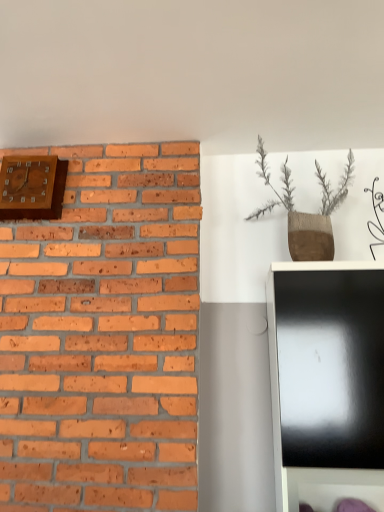
What do you see at coordinates (32, 187) in the screenshot?
I see `wooden clock at upper left` at bounding box center [32, 187].

At what (x,y) coordinates should I click in order to perform the action: click on wooden clock at upper left. Please return your answer as a coordinate pair (x, y). Image resolution: width=384 pixels, height=512 pixels. Looking at the image, I should click on (32, 187).

Describe the element at coordinates (306, 213) in the screenshot. I see `textured brown vase at upper right` at that location.

Locate an element on the screen. The height and width of the screenshot is (512, 384). textured brown vase at upper right is located at coordinates (306, 213).

I want to click on wooden clock at upper left, so click(x=32, y=187).

Considering the positions of objects wooden clock at upper left and textured brown vase at upper right in the image provided, who is more to the left, wooden clock at upper left or textured brown vase at upper right?

From the viewer's perspective, wooden clock at upper left appears more on the left side.

From the picture: Does wooden clock at upper left come in front of textured brown vase at upper right?

No, wooden clock at upper left is further to the viewer.

Considering the positions of point (49, 217) and point (312, 240), is point (49, 217) closer or farther from the camera than point (312, 240)?

Point (49, 217).

From the image's perspective, between wooden clock at upper left and textured brown vase at upper right, who is located below?

textured brown vase at upper right.

From a real-world perspective, who is located lower, wooden clock at upper left or textured brown vase at upper right?

In real-world perspective, textured brown vase at upper right is lower.

In terms of width, does wooden clock at upper left look wider or thinner when compared to textured brown vase at upper right?

wooden clock at upper left is thinner than textured brown vase at upper right.

In terms of height, does wooden clock at upper left look taller or shorter compared to textured brown vase at upper right?

Considering their sizes, wooden clock at upper left has less height than textured brown vase at upper right.

Based on their sizes in the image, would you say wooden clock at upper left is bigger or smaller than textured brown vase at upper right?

Clearly, wooden clock at upper left is smaller in size than textured brown vase at upper right.

Would you say wooden clock at upper left is outside textured brown vase at upper right?

Yes, wooden clock at upper left is located beyond the bounds of textured brown vase at upper right.

Are wooden clock at upper left and textured brown vase at upper right far apart?

wooden clock at upper left is far away from textured brown vase at upper right.

Is wooden clock at upper left oriented towards textured brown vase at upper right?

No, wooden clock at upper left is not facing towards textured brown vase at upper right.

Find the location of `houseplant in front of the wooden clock at upper left`. houseplant in front of the wooden clock at upper left is located at coordinates (306, 213).

Considering the positions of objects textured brown vase at upper right and wooden clock at upper left in the image provided, who is more to the left, textured brown vase at upper right or wooden clock at upper left?

wooden clock at upper left.

Does textured brown vase at upper right lie in front of wooden clock at upper left?

That is True.

Does point (285, 159) come behind point (48, 176)?

Yes, it is.

In the scene shown: From the image's perspective, is textured brown vase at upper right located above wooden clock at upper left?

No.

From a real-world perspective, which is physically below, textured brown vase at upper right or wooden clock at upper left?

From a 3D spatial view, textured brown vase at upper right is below.

Which object is wider, textured brown vase at upper right or wooden clock at upper left?

Wider between the two is textured brown vase at upper right.

Can you confirm if textured brown vase at upper right is taller than wooden clock at upper left?

Indeed, textured brown vase at upper right has a greater height compared to wooden clock at upper left.

In terms of size, does textured brown vase at upper right appear bigger or smaller than wooden clock at upper left?

textured brown vase at upper right is bigger than wooden clock at upper left.

In the scene shown: Which is correct: textured brown vase at upper right is inside wooden clock at upper left, or outside of it?

textured brown vase at upper right lies outside wooden clock at upper left.

From the picture: Are textured brown vase at upper right and wooden clock at upper left beside each other?

No, textured brown vase at upper right is not with wooden clock at upper left.

Is textured brown vase at upper right facing away from wooden clock at upper left?

No, textured brown vase at upper right is not facing away from wooden clock at upper left.

How much distance is there between textured brown vase at upper right and wooden clock at upper left?

The distance of textured brown vase at upper right from wooden clock at upper left is 3.39 feet.

In the image, there is a wooden clock at upper left. What are the coordinates of `houseplant below it (from the image's perspective)` in the screenshot? It's located at (306, 213).

Identify the location of clock behind the textured brown vase at upper right. Image resolution: width=384 pixels, height=512 pixels. (32, 187).

At what (x,y) coordinates should I click in order to perform the action: click on houseplant below the wooden clock at upper left (from the image's perspective). Please return your answer as a coordinate pair (x, y). This screenshot has height=512, width=384. Looking at the image, I should click on (x=306, y=213).